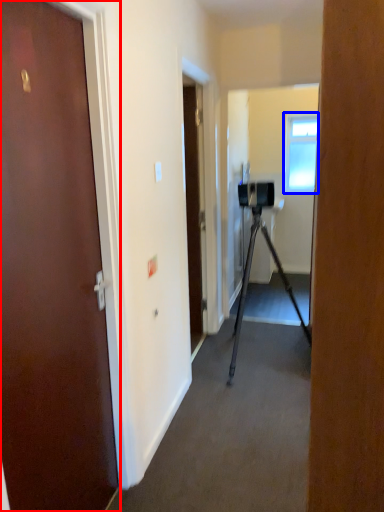
Question: Which object appears closest to the camera in this image, door (highlighted by a red box) or window (highlighted by a blue box)?

Choices:
 (A) door
 (B) window

Answer: (A)